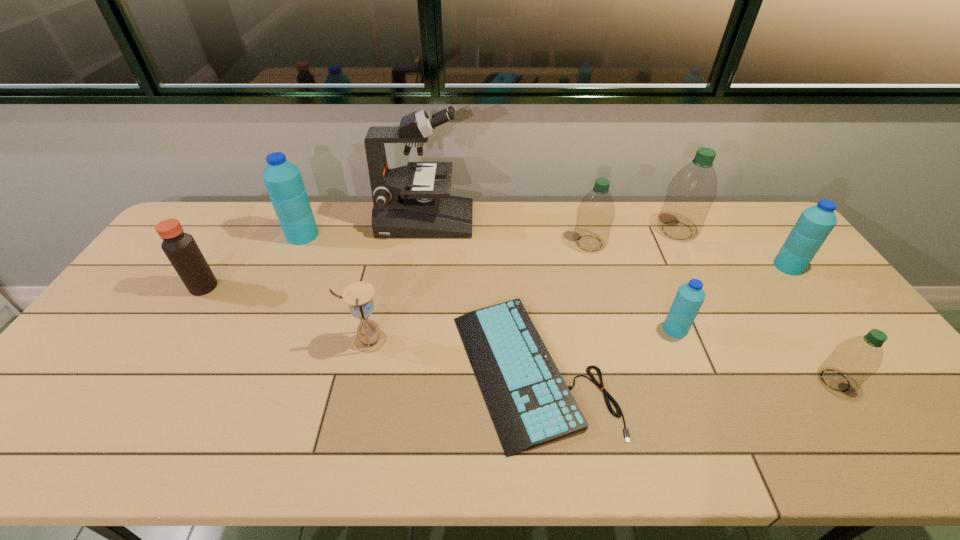
This screenshot has height=540, width=960. I want to click on vacant space at the far edge of the desktop, so click(356, 226).

The width and height of the screenshot is (960, 540). In the image, there is a desktop. Identify the location of vacant space at the near edge. (145, 428).

Locate an element on the screen. The image size is (960, 540). vacant space at the left edge of the desktop is located at coordinates (110, 388).

The height and width of the screenshot is (540, 960). I want to click on vacant space at the right edge of the desktop, so click(756, 262).

In the image, there is a desktop. Identify the location of vacant space at the far left corner. This screenshot has width=960, height=540. pyautogui.click(x=244, y=201).

Locate an element on the screen. vacant space in between the rightmost water bottle and the fifth nearest object is located at coordinates (496, 276).

Find the location of a particular element. The image size is (960, 540). vacant area that lies between the leftmost blue water bottle and the microscope is located at coordinates (364, 228).

The image size is (960, 540). I want to click on vacant area between the shortest object and the second nearest water bottle, so click(604, 349).

The width and height of the screenshot is (960, 540). In order to click on empty location between the fifth farthest object and the brown vinegar in this screenshot , I will do tap(496, 276).

The image size is (960, 540). Identify the location of free space between the rightmost water bottle and the third water bottle from right to left. (732, 248).